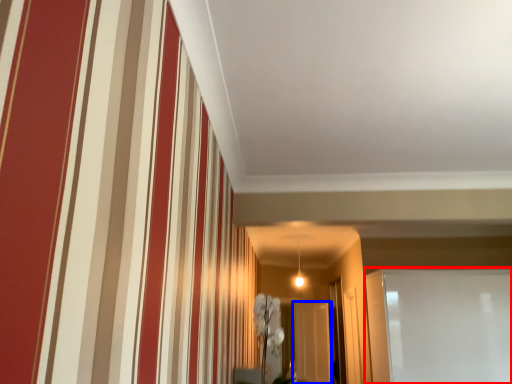
Question: Which object is further to the camera taking this photo, glass door (highlighted by a red box) or glass door (highlighted by a blue box)?

Choices:
 (A) glass door
 (B) glass door

Answer: (B)